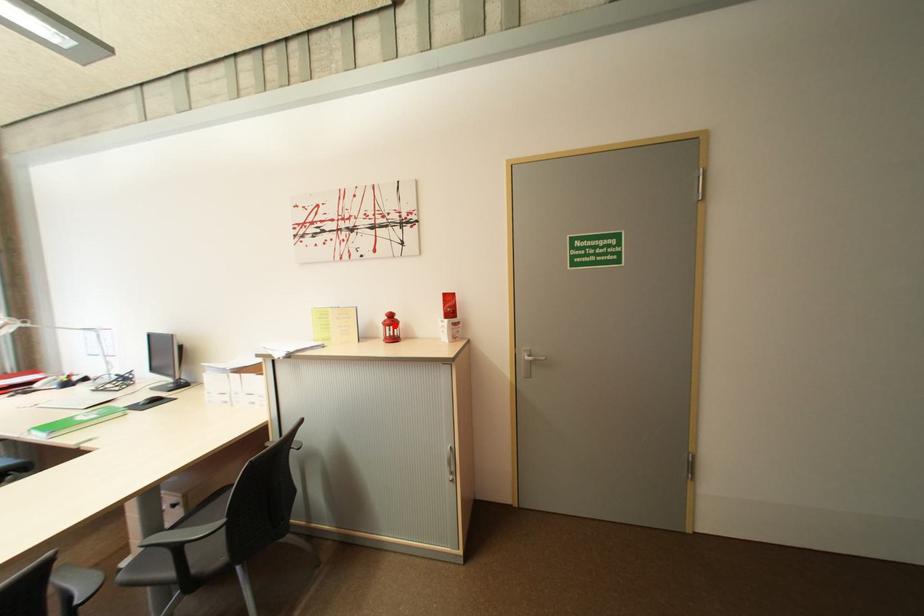
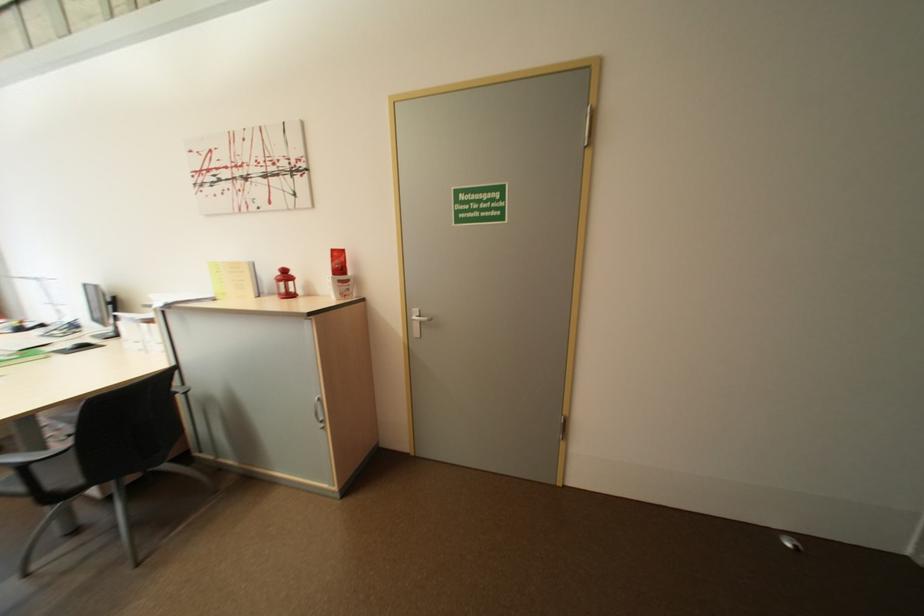
Where in the second image is the point corresponding to the highlighted location from the first image?

(286, 282)